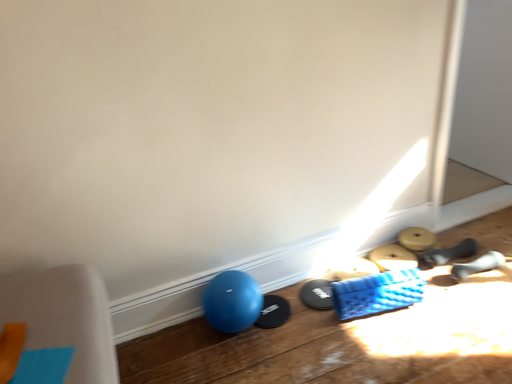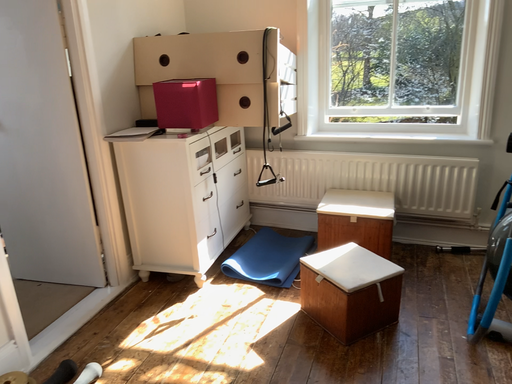
Question: How did the camera likely rotate when shooting the video?

Choices:
 (A) rotated downward
 (B) rotated upward

Answer: (B)